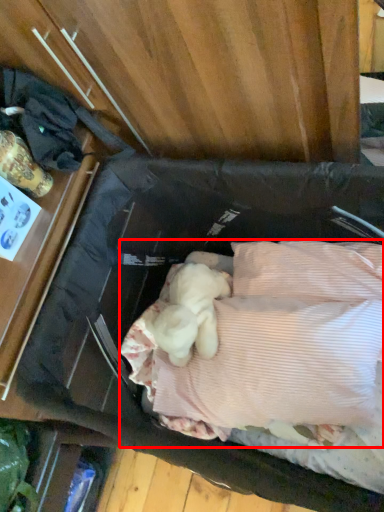
Question: Where is wide (annotated by the red box) located in relation to clothing in the image?

Choices:
 (A) right
 (B) left

Answer: (A)